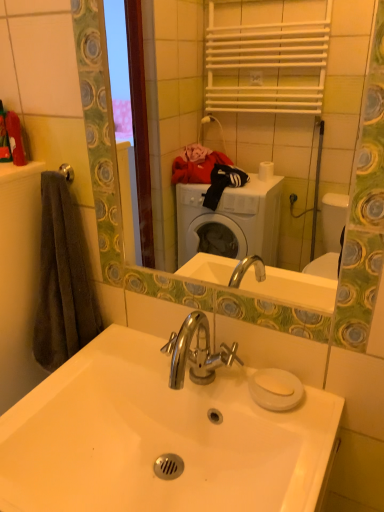
Question: Do you think silver metallic towel bar at upper left is within white glossy sink at center, or outside of it?

Choices:
 (A) outside
 (B) inside

Answer: (A)

Question: From the image's perspective, relative to white glossy sink at center, is silver metallic towel bar at upper left above or below?

Choices:
 (A) above
 (B) below

Answer: (A)

Question: Considering the real-world distances, which object is farthest from the dark gray towel at left?

Choices:
 (A) white glossy mirror at upper center
 (B) white glossy sink at center
 (C) silver metallic towel bar at upper left

Answer: (A)

Question: Estimate the real-world distances between objects in this image. Which object is closer to the white glossy sink at center?

Choices:
 (A) white glossy mirror at upper center
 (B) silver metallic towel bar at upper left
 (C) dark gray towel at left

Answer: (C)